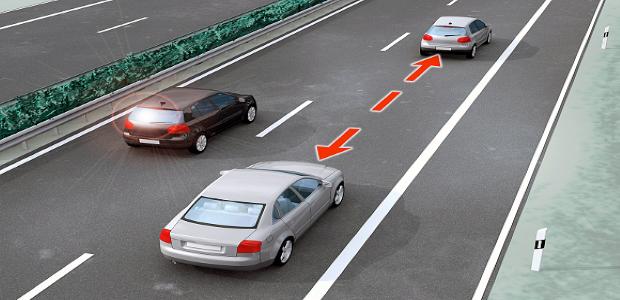
Identify the location of green divider. (209, 41), (126, 67), (50, 98), (15, 114).